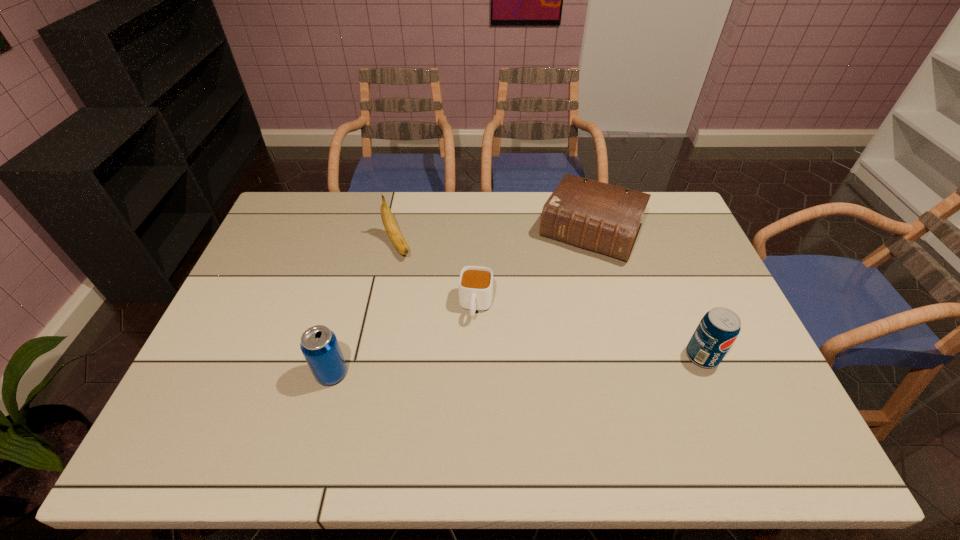
Where is `the left pop`? Image resolution: width=960 pixels, height=540 pixels. the left pop is located at coordinates (x=319, y=345).

I want to click on the right pop, so click(x=718, y=329).

You are a GUI agent. You are given a task and a screenshot of the screen. Output one action in this format:
    pyautogui.click(x=<x>, y=<y>)
    Task: Click on the fourth object from right to left
    Image resolution: width=960 pixels, height=540 pixels.
    Given the screenshot: What is the action you would take?
    pyautogui.click(x=390, y=225)

You are a GUI agent. You are given a task and a screenshot of the screen. Output one action in this format:
    pyautogui.click(x=<x>, y=<y>)
    Task: Click on the second shortest object
    This screenshot has width=960, height=540.
    Given the screenshot: What is the action you would take?
    pyautogui.click(x=596, y=216)

At what (x,y) coordinates should I click in order to perform the action: click on the shortest object. Please return your answer as a coordinate pair (x, y). This screenshot has height=540, width=960. Looking at the image, I should click on (475, 283).

This screenshot has height=540, width=960. I want to click on the third object from left to right, so click(x=475, y=283).

What are the coordinates of `free region located 0.210m on the left of the leftmost object` in the screenshot? It's located at (233, 373).

Identify the location of vacant space located 0.200m on the left of the right pop. The image size is (960, 540). (610, 356).

The height and width of the screenshot is (540, 960). I want to click on free region located 0.250m at the start of the peel on the fourth object from right to left, so click(x=437, y=312).

Find the location of a particular element. The width and height of the screenshot is (960, 540). free space located 0.280m at the start of the peel on the fourth object from right to left is located at coordinates (442, 319).